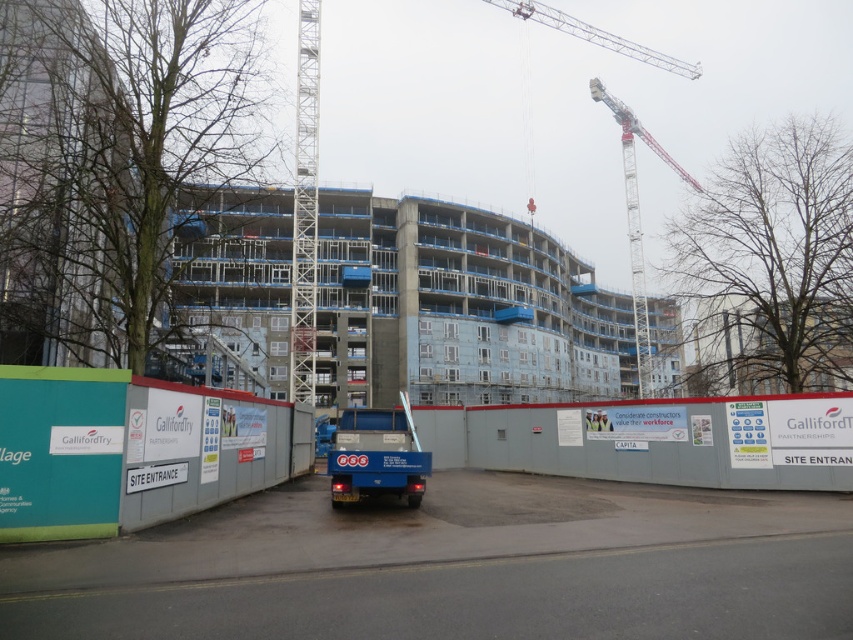
Question: Which object appears closest to the camera in this image?

Choices:
 (A) concrete building at center
 (B) metallic silver crane at upper center

Answer: (A)

Question: Does concrete wall at center appear under white metal crane at upper right?

Choices:
 (A) yes
 (B) no

Answer: (A)

Question: Estimate the real-world distances between objects in this image. Which object is farther from the concrete building at center?

Choices:
 (A) metallic silver crane at upper center
 (B) concrete wall at center
 (C) white metal crane at upper right

Answer: (A)

Question: Observing the image, what is the correct spatial positioning of white metal crane at upper right in reference to metallic silver crane at upper center?

Choices:
 (A) right
 (B) left

Answer: (A)

Question: Which object is the farthest from the metallic silver crane at upper center?

Choices:
 (A) concrete wall at center
 (B) white metal crane at upper right

Answer: (A)

Question: Does concrete wall at center appear on the right side of white metal crane at upper right?

Choices:
 (A) yes
 (B) no

Answer: (B)